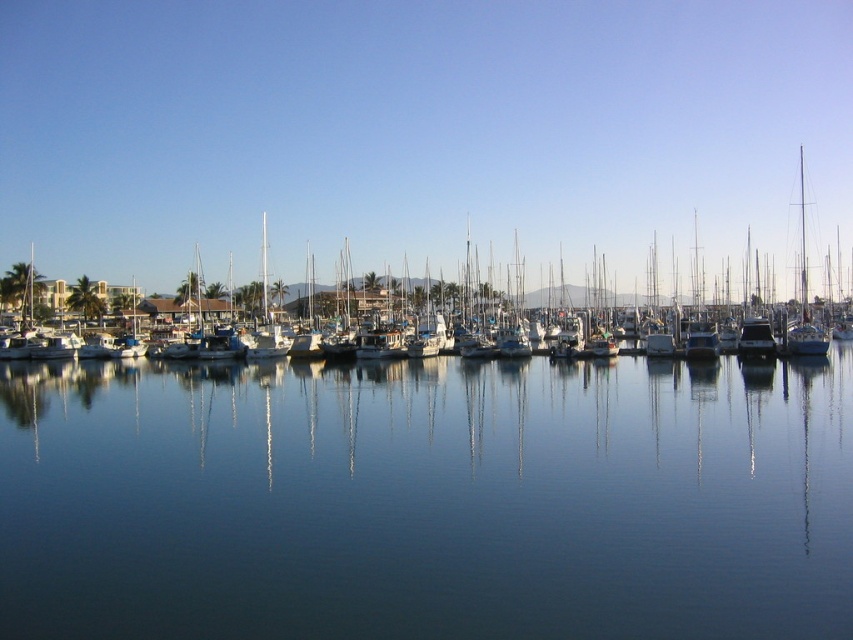
You are standing at the point marked by the coordinates point (427,500) in the marina scene. What is the immediate surface you are standing on?

The point (427,500) is on transparent blue water at center, so you are standing on transparent blue water at center.

You are a photographer planning to capture the marina scene. You notice the transparent blue water at center and the white matte boats at center. Which of these two elements appears narrower in the image?

The transparent blue water at center is thinner than the white matte boats at center, so the transparent blue water at center appears narrower in the image.

You are a photographer planning to take a photo of the transparent blue water at center and the white matte boats at center. Based on their positions, which one would appear closer to the camera in the final photo?

The transparent blue water at center appears closer to the camera because it is positioned in front of the white matte boats at center in the scene.